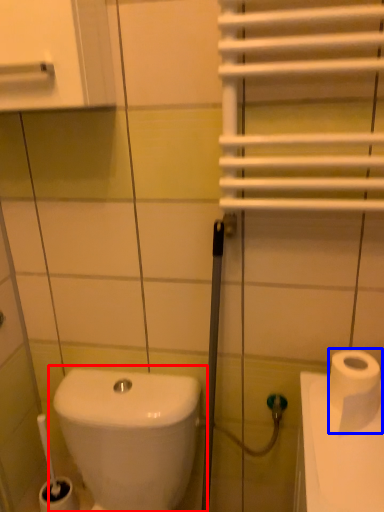
Question: Which object appears closest to the camera in this image, toilet (highlighted by a red box) or toilet paper (highlighted by a blue box)?

Choices:
 (A) toilet
 (B) toilet paper

Answer: (A)